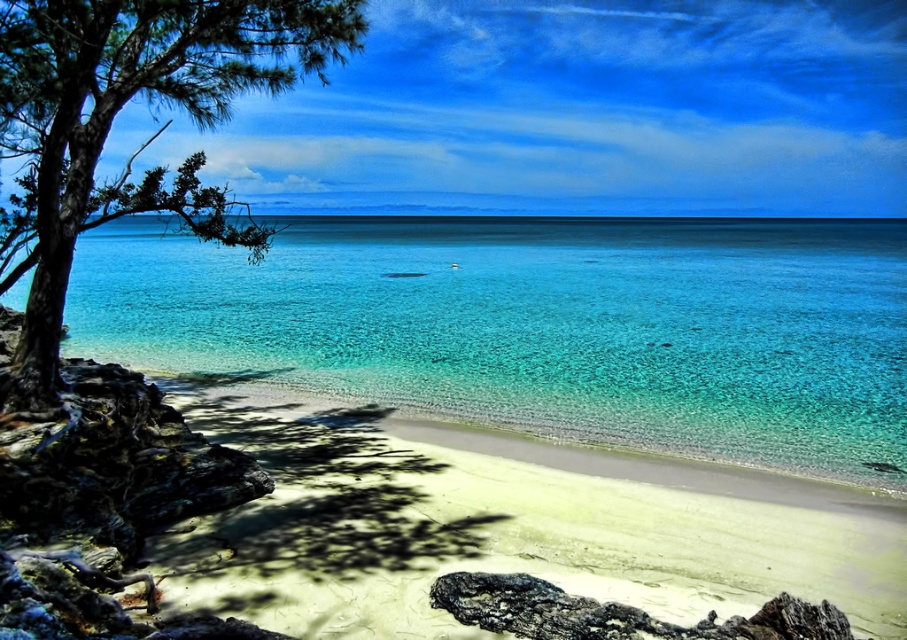
You are standing on the beach and want to take a photo of the clear blue water at center and the green matte tree at left. Which object should you zoom in on to capture more details of its height?

The clear blue water at center is taller than the green matte tree at left, so you should zoom in on the clear blue water at center to capture more details of its height.

You are standing on the beach looking out at the water. There is a point marked at coordinates (542, 326). What color is the water at that point?

The water at the point marked (542, 326) is clear blue.

You are standing on the beach and want to walk to the clear blue water at center. However, there is a green matte tree at left in your path. Which direction should you move to avoid the tree and reach the water?

The clear blue water at center is positioned over the green matte tree at left, so you should move to the right of the green matte tree at left to reach the water without obstruction.